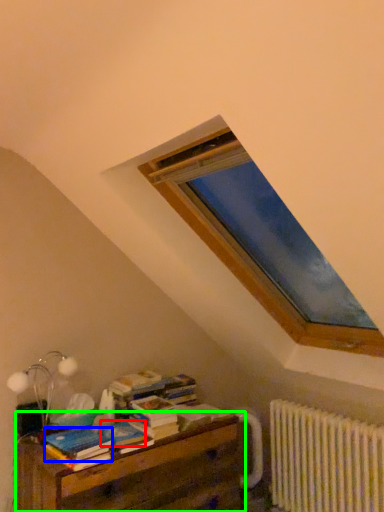
Question: Which is nearer to the paperback book (highlighted by a red box)? paperback book (highlighted by a blue box) or nightstand (highlighted by a green box).

Choices:
 (A) paperback book
 (B) nightstand

Answer: (A)